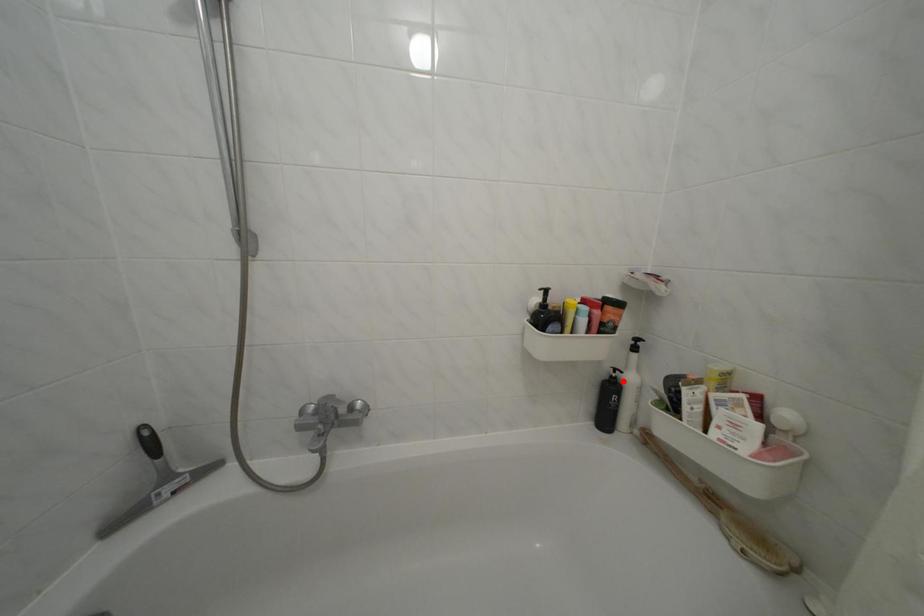
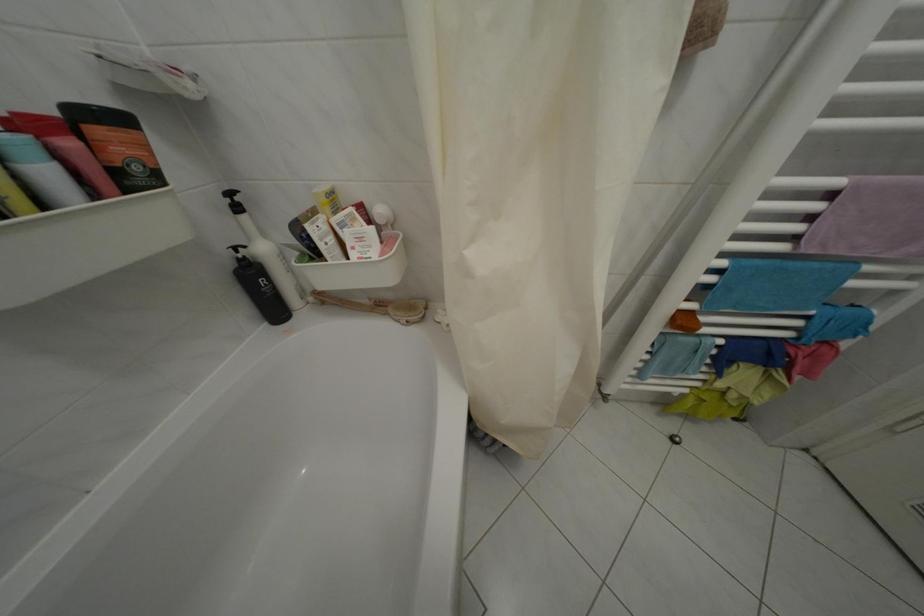
The point at the highlighted location is marked in the first image. Where is the corresponding point in the second image?

(249, 262)